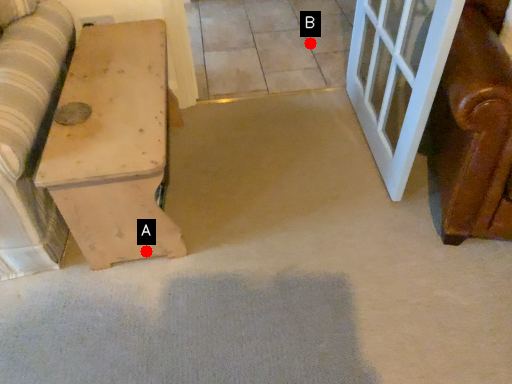
Question: Two points are circled on the image, labeled by A and B beside each circle. Which point is farther from the camera taking this photo?

Choices:
 (A) A is further
 (B) B is further

Answer: (B)